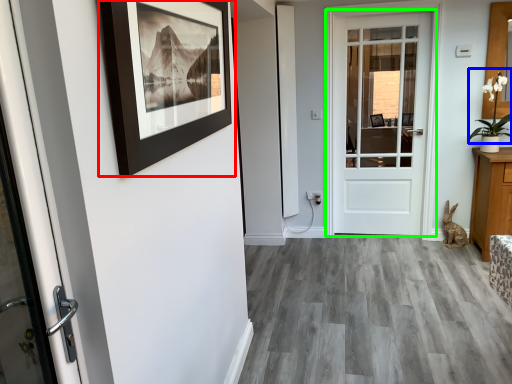
Question: Which is nearer to the picture frame (highlighted by a red box)? plant (highlighted by a blue box) or door (highlighted by a green box).

Choices:
 (A) plant
 (B) door

Answer: (B)